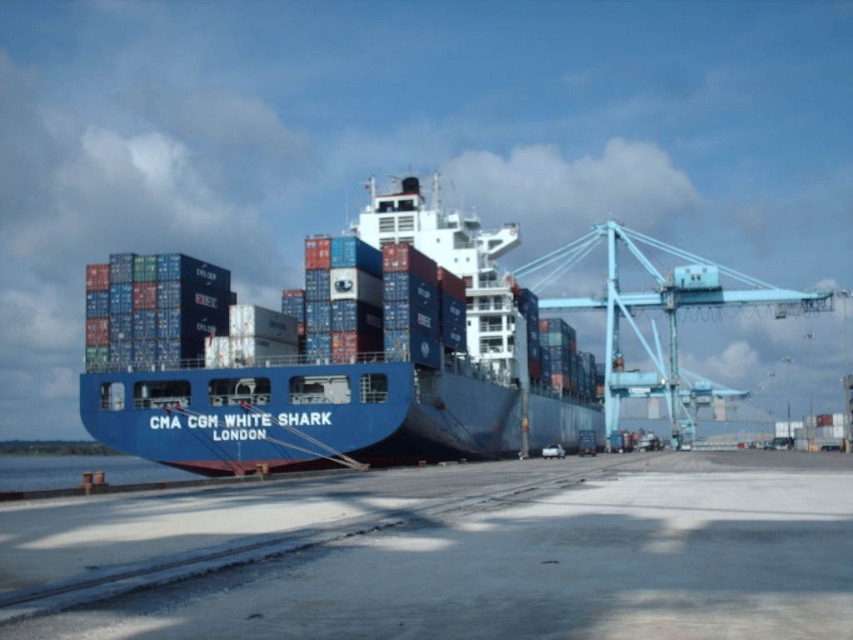
Can you confirm if blue metallic crane at right is wider than blue water at lower left?

No.

Is point (679, 422) less distant than point (80, 461)?

Yes, point (679, 422) is in front of point (80, 461).

The width and height of the screenshot is (853, 640). What do you see at coordinates (663, 321) in the screenshot? I see `blue metallic crane at right` at bounding box center [663, 321].

Find the location of `blue metallic crane at right`. blue metallic crane at right is located at coordinates (663, 321).

Can you confirm if blue matte container ship at center is positioned above blue water at lower left?

Yes.

This screenshot has width=853, height=640. I want to click on blue matte container ship at center, so click(x=339, y=355).

Between blue matte container ship at center and blue metallic crane at right, which one is positioned lower?

Positioned lower is blue metallic crane at right.

What are the coordinates of `blue matte container ship at center` in the screenshot? It's located at (339, 355).